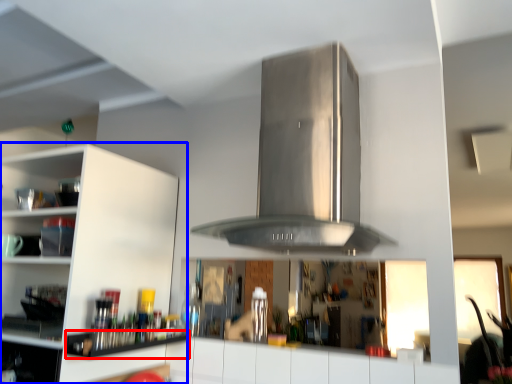
Question: Among these objects, which one is nearest to the camera, shelf (highlighted by a red box) or cabinetry (highlighted by a blue box)?

Choices:
 (A) shelf
 (B) cabinetry

Answer: (B)